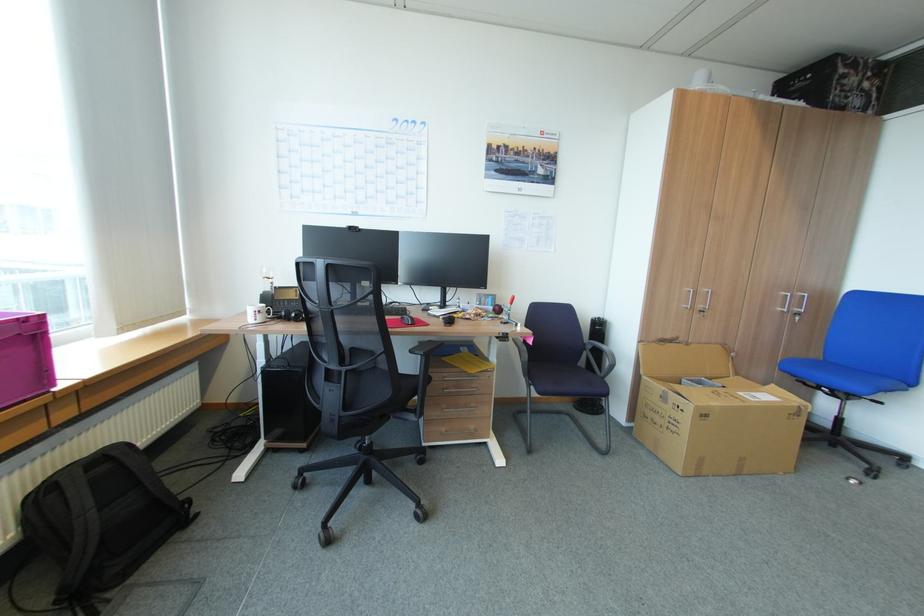
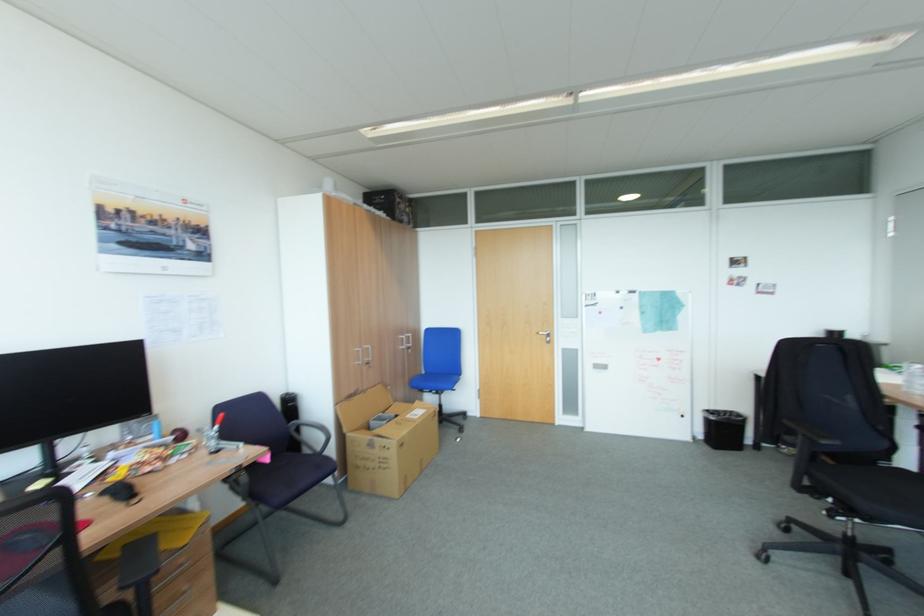
The point at (596,342) is marked in the first image. Where is the corresponding point in the second image?

(298, 424)